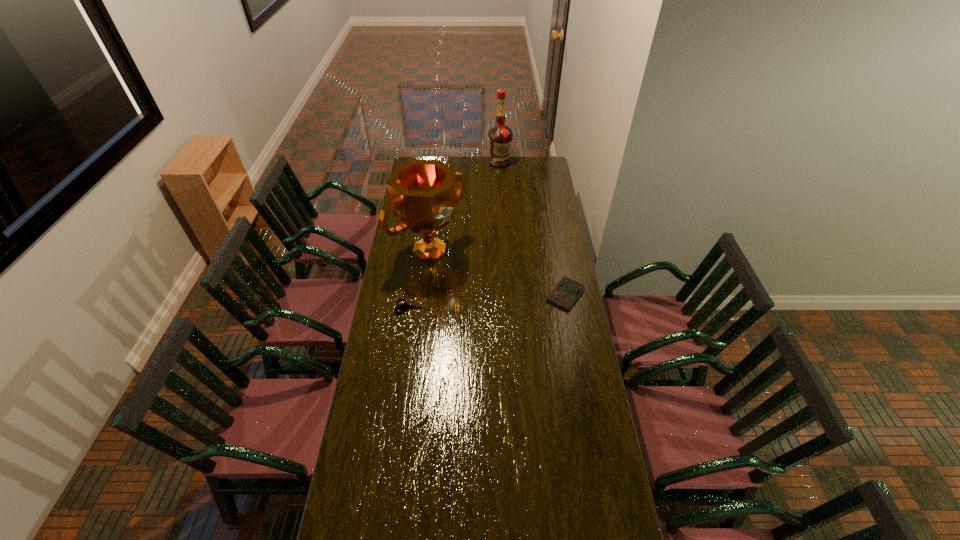
The width and height of the screenshot is (960, 540). I want to click on the shortest object, so click(404, 306).

You are a GUI agent. You are given a task and a screenshot of the screen. Output one action in this format:
    pyautogui.click(x=<x>, y=<y>)
    Task: Click on the calculator
    The width and height of the screenshot is (960, 540).
    Given the screenshot: What is the action you would take?
    pyautogui.click(x=567, y=291)

Where is `the second shortest object`? Image resolution: width=960 pixels, height=540 pixels. the second shortest object is located at coordinates (567, 291).

Locate an element on the screen. This screenshot has height=540, width=960. the farthest object is located at coordinates (500, 136).

Locate an element on the screen. This screenshot has width=960, height=540. liquor is located at coordinates (500, 136).

I want to click on award, so click(x=422, y=193).

The image size is (960, 540). What are the coordinates of `vacant space situated on the right of the shortest object` in the screenshot? It's located at (473, 307).

This screenshot has width=960, height=540. I want to click on free space located on the front of the calculator, so click(572, 335).

Where is `vacant space situated 0.340m on the front and back of the third object from left to right`? The image size is (960, 540). vacant space situated 0.340m on the front and back of the third object from left to right is located at coordinates (500, 200).

This screenshot has height=540, width=960. In order to click on vacant space located on the front and back of the third object from left to right in this screenshot , I will do `click(500, 177)`.